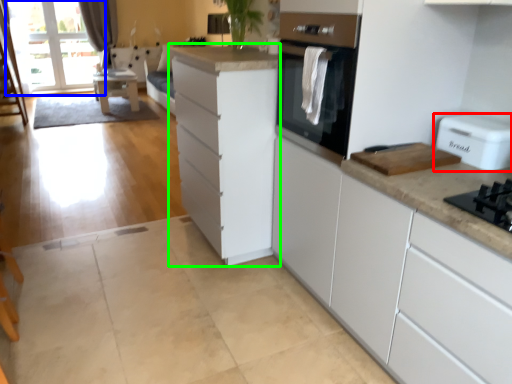
Question: Based on their relative distances, which object is nearer to home appliance (highlighted by a red box)? Choose from window screen (highlighted by a blue box) and cabinetry (highlighted by a green box).

Choices:
 (A) window screen
 (B) cabinetry

Answer: (B)